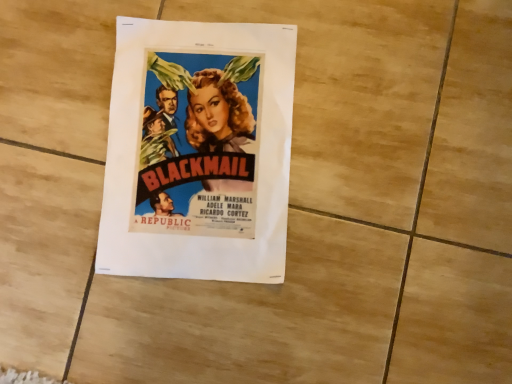
Identify the location of vacant point above matte paper poster at center (from a real-world perspective). The image size is (512, 384). (198, 145).